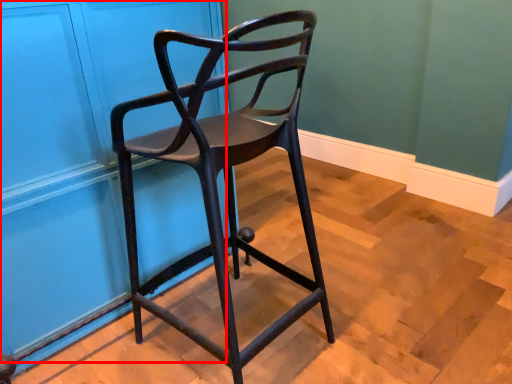
Question: From the image's perspective, what is the correct spatial positioning of door (annotated by the red box) in reference to chair?

Choices:
 (A) below
 (B) above

Answer: (B)